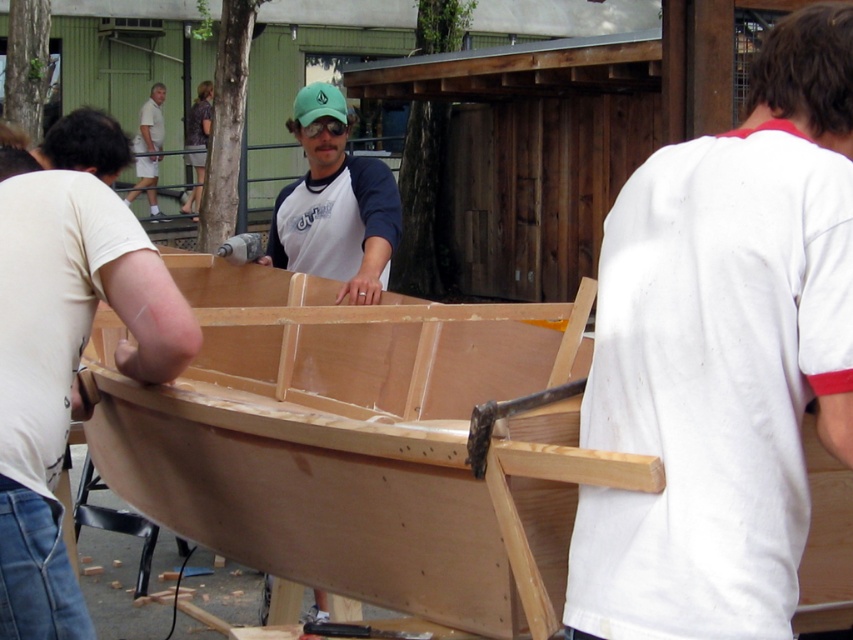
You are a visitor observing the boat construction scene. You notice the natural wood canoe at center and the green matte baseball cap at center. Which object is closer to you?

The natural wood canoe at center is closer to you because it is in front of the green matte baseball cap at center.